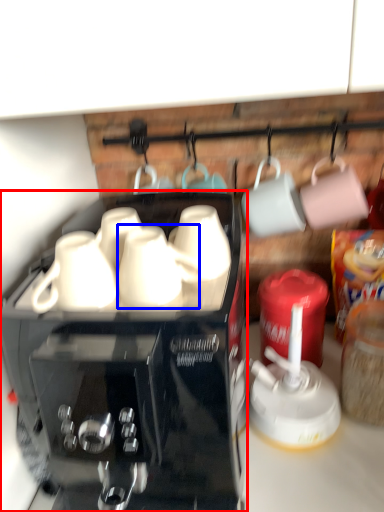
Question: Which of the following is the farthest to the observer, coffee maker (highlighted by a red box) or mug (highlighted by a blue box)?

Choices:
 (A) coffee maker
 (B) mug

Answer: (B)